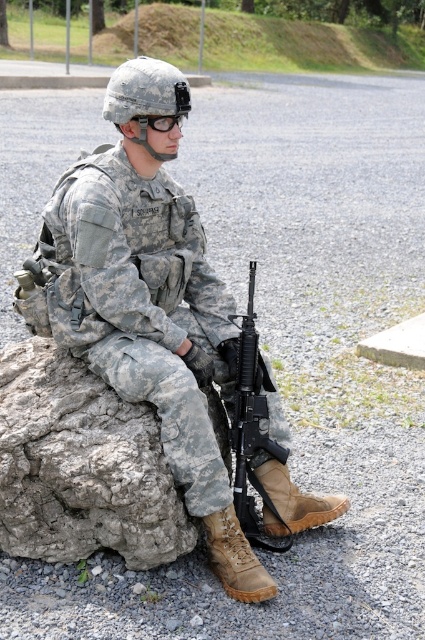
Which of these two, gray rough rock at lower left or black matte/glossy goggles at upper center, stands shorter?

black matte/glossy goggles at upper center

Which is in front, point (30, 480) or point (172, 124)?

Positioned in front is point (30, 480).

The height and width of the screenshot is (640, 425). Find the location of `gray rough rock at lower left`. gray rough rock at lower left is located at coordinates (82, 467).

Which is more to the left, camouflage uniform at center or black matte rifle at lower center?

Positioned to the left is camouflage uniform at center.

Between point (42, 324) and point (235, 474), which one is positioned in front?

Positioned in front is point (42, 324).

I want to click on camouflage uniform at center, so click(x=147, y=300).

Can you confirm if black matte rifle at lower center is positioned to the left of black matte/glossy goggles at upper center?

Incorrect, black matte rifle at lower center is not on the left side of black matte/glossy goggles at upper center.

Is the position of black matte rifle at lower center more distant than that of black matte/glossy goggles at upper center?

Yes, it is behind black matte/glossy goggles at upper center.

This screenshot has height=640, width=425. What are the coordinates of `black matte rifle at lower center` in the screenshot? It's located at (252, 428).